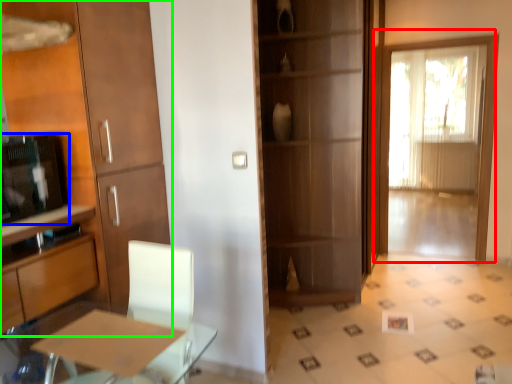
Question: Which object is positioned farthest from door (highlighted by a red box)? Select from appliance (highlighted by a blue box) and cabinetry (highlighted by a green box).

Choices:
 (A) appliance
 (B) cabinetry

Answer: (A)